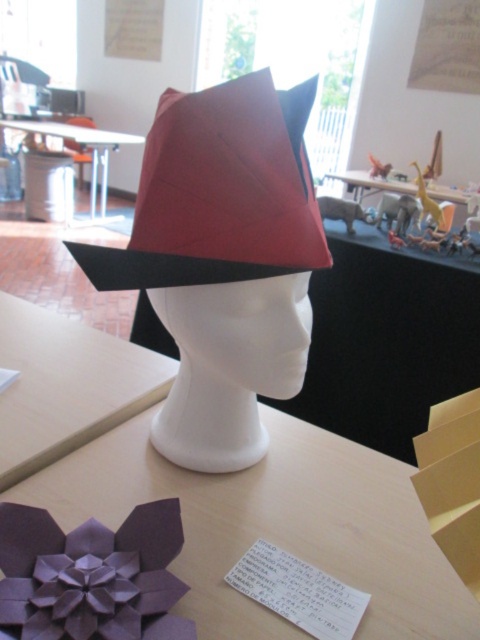
Locate an element on the screen. Image resolution: width=480 pixels, height=640 pixels. wooden at center is located at coordinates (67, 385).

Is point (158, 200) closer to camera compared to point (134, 134)?

Yes, it is.

Who is positioned more to the right, matte paper hat at center or matte white table at center?

matte paper hat at center

Locate an element on the screen. The width and height of the screenshot is (480, 640). matte paper hat at center is located at coordinates click(x=219, y=192).

What are the coordinates of `matte paper hat at center` in the screenshot? It's located at (219, 192).

Between point (15, 429) and point (52, 125), which one is positioned behind?

The point (52, 125) is more distant.

The width and height of the screenshot is (480, 640). In order to click on wooden at center in this screenshot , I will do `click(67, 385)`.